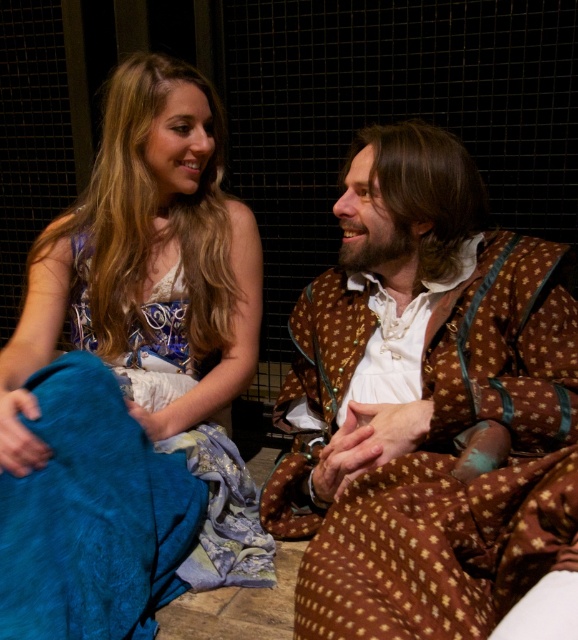
Which is more to the left, brown textured fabric at right or silky blue fabric at lower left?

From the viewer's perspective, silky blue fabric at lower left appears more on the left side.

Is point (310, 604) positioned after point (257, 573)?

No, (310, 604) is in front of (257, 573).

Where is `brown textured fabric at right`? Image resolution: width=578 pixels, height=640 pixels. brown textured fabric at right is located at coordinates (424, 404).

Which of these two, brown textured fabric at right or matte blue fabric at left, stands shorter?

Standing shorter between the two is brown textured fabric at right.

Does brown textured fabric at right have a lesser height compared to matte blue fabric at left?

Yes.

Does point (512, 376) come in front of point (94, 195)?

Yes, it is in front of point (94, 195).

Where is `brown textured fabric at right`? The height and width of the screenshot is (640, 578). brown textured fabric at right is located at coordinates (424, 404).

Describe the element at coordinates (132, 378) in the screenshot. The height and width of the screenshot is (640, 578). I see `matte blue fabric at left` at that location.

Does point (187, 68) come farther from viewer compared to point (224, 419)?

No.

The width and height of the screenshot is (578, 640). What do you see at coordinates (132, 378) in the screenshot? I see `matte blue fabric at left` at bounding box center [132, 378].

You are a GUI agent. You are given a task and a screenshot of the screen. Output one action in this format:
    pyautogui.click(x=<x>, y=<y>)
    Task: Click on the matte blue fabric at left
    The width and height of the screenshot is (578, 640).
    Given the screenshot: What is the action you would take?
    pyautogui.click(x=132, y=378)